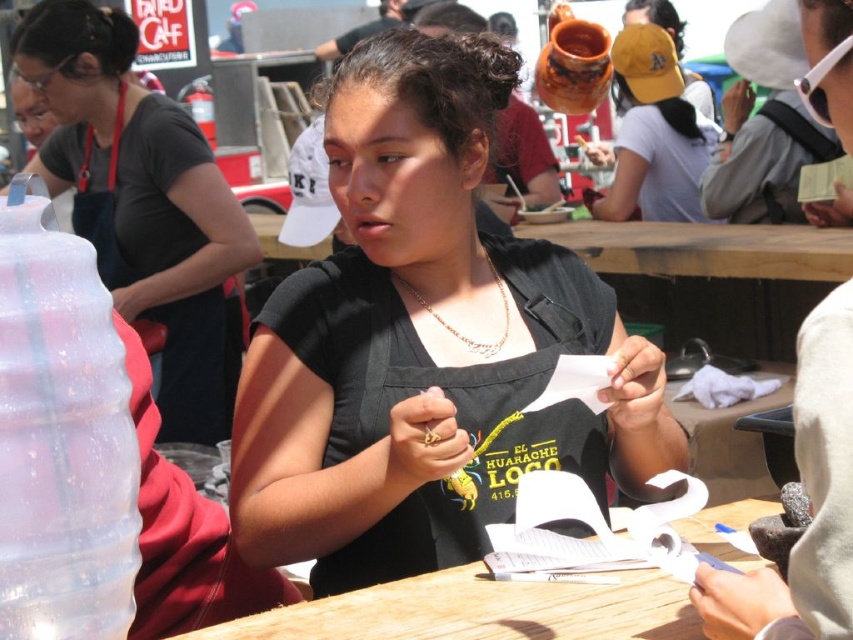
Question: Is wooden table at center above gold chain necklace at center?

Choices:
 (A) yes
 (B) no

Answer: (B)

Question: Which point is closer to the camera?

Choices:
 (A) (236, 620)
 (B) (131, 88)

Answer: (A)

Question: Which of the following is the farthest from the observer?

Choices:
 (A) (409, 605)
 (B) (257, 451)
 (C) (38, 54)

Answer: (C)

Question: Which is nearer to the gold chain necklace at center?

Choices:
 (A) wooden table at center
 (B) matte yellow cap at upper center
 (C) matte black apron at center

Answer: (A)

Question: Can you confirm if black matte shirt at center is bigger than wooden table at center?

Choices:
 (A) yes
 (B) no

Answer: (A)

Question: Is black matte shirt at center behind gold chain necklace at center?

Choices:
 (A) no
 (B) yes

Answer: (A)